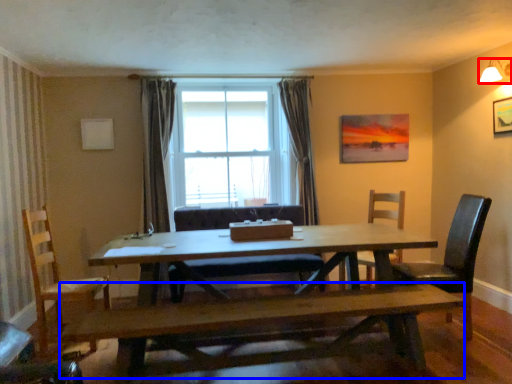
Question: Which object appears closest to the camera in this image, lamp (highlighted by a red box) or bench (highlighted by a blue box)?

Choices:
 (A) lamp
 (B) bench

Answer: (B)